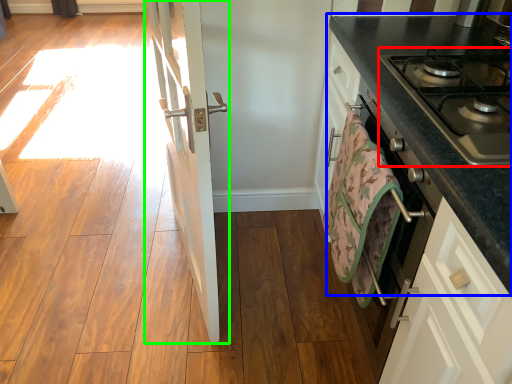
Question: Based on their relative distances, which object is nearer to gas stove (highlighted by a red box)? Choose from countertop (highlighted by a blue box) and door (highlighted by a green box).

Choices:
 (A) countertop
 (B) door

Answer: (A)